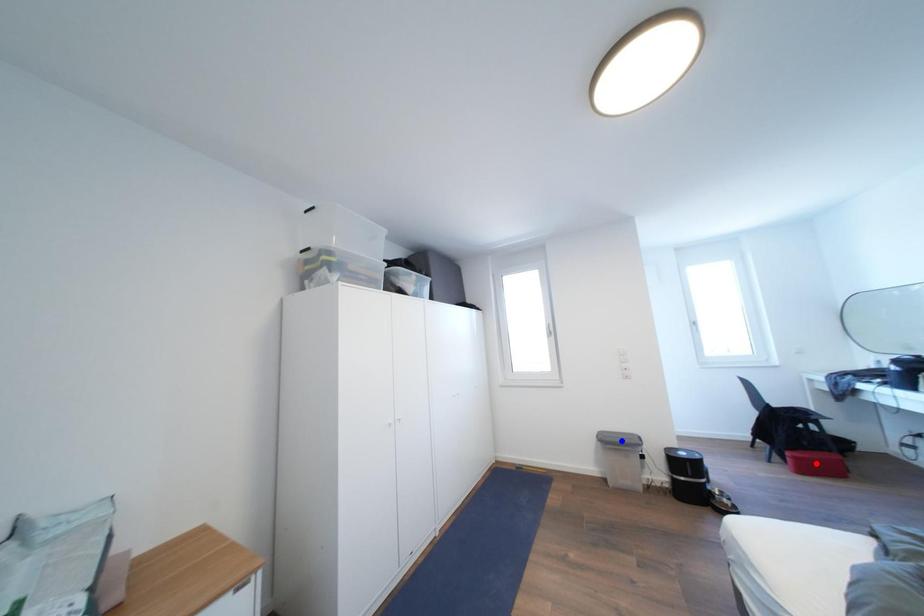
Question: In the image, two points are highlighted. Which point is nearer to the camera? Reply with the corresponding letter.

Choices:
 (A) blue point
 (B) red point

Answer: (B)